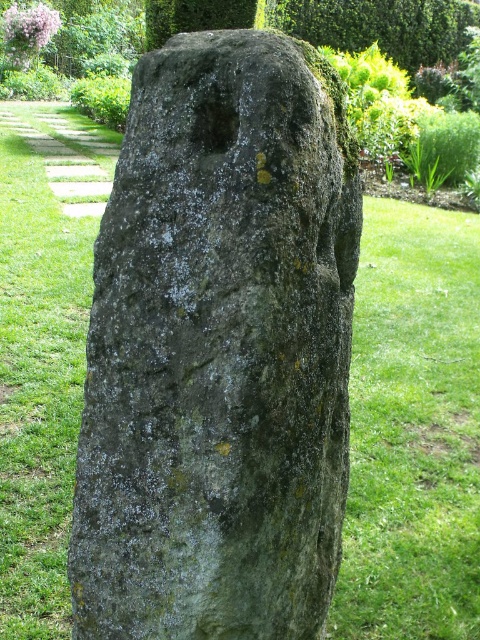
You are standing at the camera position and want to place a 3.5 feet wide decorative mat between yourself and the green mossy stone at center. Will the mat fit in the available space?

The distance between you and the green mossy stone at center is 4.42 feet, which is greater than the 3.5 feet width of the mat. Therefore, the mat will fit in the available space.